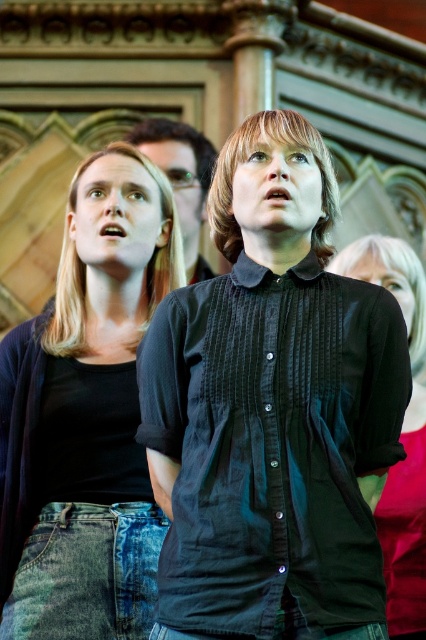
Does black cotton shirt at center have a greater width compared to black button-up shirt at center?

Correct, the width of black cotton shirt at center exceeds that of black button-up shirt at center.

In the scene shown: Between black cotton shirt at center and black button-up shirt at center, which one has less height?

With less height is black cotton shirt at center.

Locate an element on the screen. black cotton shirt at center is located at coordinates (273, 444).

Does black cotton shirt at center appear on the right side of denim jeans at left?

Yes, black cotton shirt at center is to the right of denim jeans at left.

Is black cotton shirt at center above denim jeans at left?

Incorrect, black cotton shirt at center is not positioned above denim jeans at left.

Is point (351, 301) closer to viewer compared to point (89, 577)?

Yes, it is.

The width and height of the screenshot is (426, 640). I want to click on black cotton shirt at center, so click(x=273, y=444).

Can you confirm if denim jeans at left is shorter than black button-up shirt at center?

In fact, denim jeans at left may be taller than black button-up shirt at center.

Which is in front, point (143, 454) or point (385, 492)?

Point (143, 454) is more forward.

I want to click on denim jeans at left, so click(x=86, y=417).